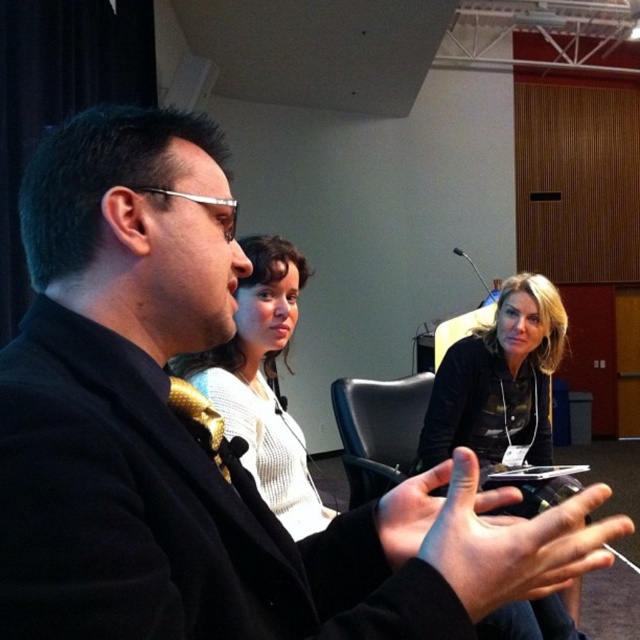
You are standing in the conference room and need to locate the black fabric shirt at center. Can you describe its position relative to the other objects in the scene?

The black fabric shirt at center is located at point (x=499, y=381) in the scene.